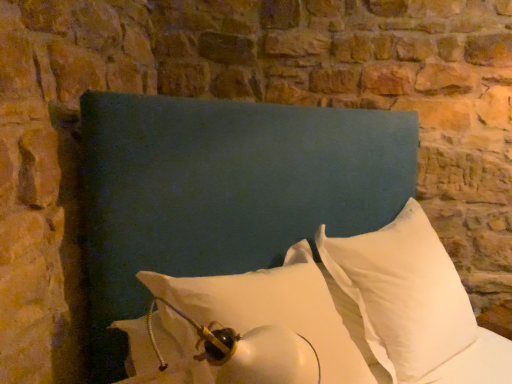
How much space does white matte pillow at center, placed as the second pillow when sorted from right to left, occupy horizontally?

45.50 centimeters.

You are a GUI agent. You are given a task and a screenshot of the screen. Output one action in this format:
    pyautogui.click(x=<x>, y=<y>)
    Task: Click on the white soft pillow at center, which appears as the 2th pillow when viewed from the left
    
    Given the screenshot: What is the action you would take?
    pyautogui.click(x=400, y=296)

In order to click on teal fabric headboard at center in this screenshot , I will do `click(385, 131)`.

The width and height of the screenshot is (512, 384). What are the coordinates of `white matte pillow at center, placed as the second pillow when sorted from right to left` in the screenshot? It's located at (272, 308).

From a real-world perspective, which object stands above the other?

teal fabric headboard at center is physically above.

Is teal fabric headboard at center not close to white soft pillow at center, which appears as the 2th pillow when viewed from the left?

No, there isn't a large distance between teal fabric headboard at center and white soft pillow at center, which appears as the 2th pillow when viewed from the left.

Considering the sizes of objects teal fabric headboard at center and white soft pillow at center, positioned as the first pillow in right-to-left order, in the image provided, who is thinner, teal fabric headboard at center or white soft pillow at center, positioned as the first pillow in right-to-left order,?

white soft pillow at center, positioned as the first pillow in right-to-left order, is thinner.

How many degrees apart are the facing directions of teal fabric headboard at center and white soft pillow at center, positioned as the first pillow in right-to-left order?

The angular difference between teal fabric headboard at center and white soft pillow at center, positioned as the first pillow in right-to-left order, is 2.49 degrees.

Locate an element on the screen. furniture on the right of white matte pillow at center, the first pillow viewed from the left is located at coordinates (385, 131).

Does white matte pillow at center, the first pillow viewed from the left, turn towards teal fabric headboard at center?

Yes, white matte pillow at center, the first pillow viewed from the left, is aimed at teal fabric headboard at center.

Is white matte pillow at center, placed as the second pillow when sorted from right to left, not close to teal fabric headboard at center?

white matte pillow at center, placed as the second pillow when sorted from right to left, is near teal fabric headboard at center, not far away.

Do you think white matte pillow at center, the first pillow viewed from the left, is within teal fabric headboard at center, or outside of it?

white matte pillow at center, the first pillow viewed from the left, can be found inside teal fabric headboard at center.

Which point is more forward, (416, 307) or (177, 305)?

The point (177, 305) is in front.

From the picture: Is teal fabric headboard at center turned away from white matte pillow at center, the first pillow viewed from the left?

Yes.

Is teal fabric headboard at center to the right of white matte pillow at center, the first pillow viewed from the left, from the viewer's perspective?

Indeed, teal fabric headboard at center is positioned on the right side of white matte pillow at center, the first pillow viewed from the left.

Is teal fabric headboard at center shorter than white matte pillow at center, the first pillow viewed from the left?

Incorrect, the height of teal fabric headboard at center does not fall short of that of white matte pillow at center, the first pillow viewed from the left.

Is white soft pillow at center, positioned as the first pillow in right-to-left order, closer to the viewer compared to teal fabric headboard at center?

No, white soft pillow at center, positioned as the first pillow in right-to-left order, is further to the viewer.

Is white soft pillow at center, positioned as the first pillow in right-to-left order, aimed at teal fabric headboard at center?

Yes, white soft pillow at center, positioned as the first pillow in right-to-left order, faces towards teal fabric headboard at center.

From a real-world perspective, which is physically below, white soft pillow at center, which appears as the 2th pillow when viewed from the left, or teal fabric headboard at center?

In real-world perspective, white soft pillow at center, which appears as the 2th pillow when viewed from the left, is lower.

Between white soft pillow at center, which appears as the 2th pillow when viewed from the left, and teal fabric headboard at center, which one appears on the left side from the viewer's perspective?

teal fabric headboard at center.

Could you tell me if white soft pillow at center, which appears as the 2th pillow when viewed from the left, is turned towards white matte pillow at center, the first pillow viewed from the left?

No, white soft pillow at center, which appears as the 2th pillow when viewed from the left, is not turned towards white matte pillow at center, the first pillow viewed from the left.

Would you say white soft pillow at center, positioned as the first pillow in right-to-left order, is inside or outside white matte pillow at center, the first pillow viewed from the left?

white soft pillow at center, positioned as the first pillow in right-to-left order, lies outside white matte pillow at center, the first pillow viewed from the left.

The height and width of the screenshot is (384, 512). I want to click on pillow on the right of white matte pillow at center, the first pillow viewed from the left, so click(x=400, y=296).

Looking at their sizes, would you say white soft pillow at center, which appears as the 2th pillow when viewed from the left, is wider or thinner than white matte pillow at center, the first pillow viewed from the left?

In the image, white soft pillow at center, which appears as the 2th pillow when viewed from the left, appears to be more narrow than white matte pillow at center, the first pillow viewed from the left.

Which is more to the left, white matte pillow at center, the first pillow viewed from the left, or white soft pillow at center, which appears as the 2th pillow when viewed from the left?

white matte pillow at center, the first pillow viewed from the left.

Based on the photo, is white matte pillow at center, placed as the second pillow when sorted from right to left, touching white soft pillow at center, which appears as the 2th pillow when viewed from the left?

white matte pillow at center, placed as the second pillow when sorted from right to left, and white soft pillow at center, which appears as the 2th pillow when viewed from the left, are not in contact.

Is white soft pillow at center, positioned as the first pillow in right-to-left order, inside white matte pillow at center, placed as the second pillow when sorted from right to left?

No, white soft pillow at center, positioned as the first pillow in right-to-left order, is not a part of white matte pillow at center, placed as the second pillow when sorted from right to left.

Considering the sizes of objects white matte pillow at center, placed as the second pillow when sorted from right to left, and white soft pillow at center, positioned as the first pillow in right-to-left order, in the image provided, who is taller, white matte pillow at center, placed as the second pillow when sorted from right to left, or white soft pillow at center, positioned as the first pillow in right-to-left order,?

With more height is white soft pillow at center, positioned as the first pillow in right-to-left order.

You are a GUI agent. You are given a task and a screenshot of the screen. Output one action in this format:
    pyautogui.click(x=<x>, y=<y>)
    Task: Click on the furniture above the white soft pillow at center, positioned as the first pillow in right-to-left order (from a real-world perspective)
    The image size is (512, 384).
    Given the screenshot: What is the action you would take?
    pyautogui.click(x=385, y=131)

At what (x,y) coordinates should I click in order to perform the action: click on furniture on the right side of white matte pillow at center, placed as the second pillow when sorted from right to left. Please return your answer as a coordinate pair (x, y). The image size is (512, 384). Looking at the image, I should click on click(385, 131).

From the image, which object appears to be farther from white soft pillow at center, positioned as the first pillow in right-to-left order, teal fabric headboard at center or white matte pillow at center, the first pillow viewed from the left?

Among the two, teal fabric headboard at center is located further to white soft pillow at center, positioned as the first pillow in right-to-left order.

From the image, which object appears to be farther from white soft pillow at center, positioned as the first pillow in right-to-left order, white matte pillow at center, the first pillow viewed from the left, or teal fabric headboard at center?

Among the two, teal fabric headboard at center is located further to white soft pillow at center, positioned as the first pillow in right-to-left order.

Estimate the real-world distances between objects in this image. Which object is further from teal fabric headboard at center, white soft pillow at center, which appears as the 2th pillow when viewed from the left, or white matte pillow at center, the first pillow viewed from the left?

Among the two, white soft pillow at center, which appears as the 2th pillow when viewed from the left, is located further to teal fabric headboard at center.

Which object lies further to the anchor point white matte pillow at center, the first pillow viewed from the left, white soft pillow at center, positioned as the first pillow in right-to-left order, or teal fabric headboard at center?

teal fabric headboard at center.

Estimate the real-world distances between objects in this image. Which object is further from white matte pillow at center, the first pillow viewed from the left, teal fabric headboard at center or white soft pillow at center, positioned as the first pillow in right-to-left order?

teal fabric headboard at center is positioned further to the anchor white matte pillow at center, the first pillow viewed from the left.

Based on their spatial positions, is white matte pillow at center, the first pillow viewed from the left, or white soft pillow at center, positioned as the first pillow in right-to-left order, further from teal fabric headboard at center?

The object further to teal fabric headboard at center is white soft pillow at center, positioned as the first pillow in right-to-left order.

At what (x,y) coordinates should I click in order to perform the action: click on pillow between teal fabric headboard at center and white soft pillow at center, which appears as the 2th pillow when viewed from the left, in the front-back direction. Please return your answer as a coordinate pair (x, y). Looking at the image, I should click on (272, 308).